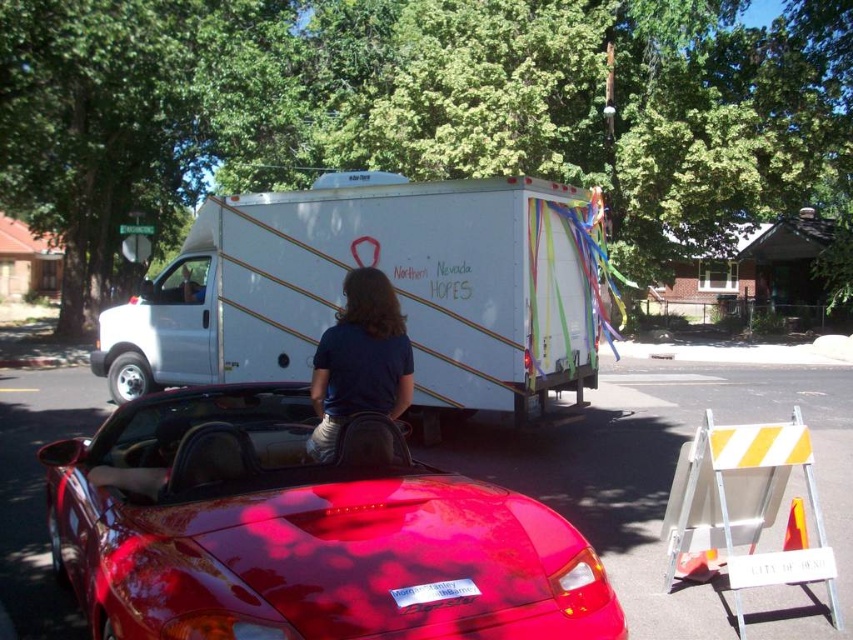
Question: Among these objects, which one is farthest from the camera?

Choices:
 (A) white matte truck at center
 (B) glossy red convertible at center
 (C) dark blue shirt at center

Answer: (A)

Question: In this image, where is glossy red convertible at center located relative to dark blue shirt at center?

Choices:
 (A) above
 (B) below

Answer: (B)

Question: Which point is farther from the camera taking this photo?

Choices:
 (A) (253, 316)
 (B) (189, 611)

Answer: (A)

Question: Which object is closer to the camera taking this photo?

Choices:
 (A) glossy red convertible at center
 (B) dark blue shirt at center
 (C) white matte truck at center

Answer: (A)

Question: Is glossy red convertible at center bigger than dark blue shirt at center?

Choices:
 (A) yes
 (B) no

Answer: (A)

Question: Observing the image, what is the correct spatial positioning of white matte truck at center in reference to dark blue shirt at center?

Choices:
 (A) right
 (B) left

Answer: (B)